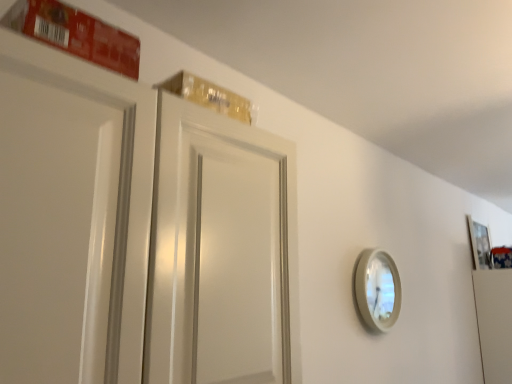
Question: In the image, is wooden picture frame at upper right positioned in front of or behind white glossy mirror at right?

Choices:
 (A) behind
 (B) front

Answer: (A)

Question: Is point (483, 259) closer or farther from the camera than point (361, 279)?

Choices:
 (A) farther
 (B) closer

Answer: (A)

Question: From a real-world perspective, relative to white glossy mirror at right, is wooden picture frame at upper right vertically above or below?

Choices:
 (A) above
 (B) below

Answer: (A)

Question: From a real-world perspective, relative to wooden picture frame at upper right, is white glossy mirror at right vertically above or below?

Choices:
 (A) below
 (B) above

Answer: (A)

Question: From the image's perspective, is white glossy mirror at right positioned above or below wooden picture frame at upper right?

Choices:
 (A) below
 (B) above

Answer: (A)

Question: In terms of size, does white glossy mirror at right appear bigger or smaller than wooden picture frame at upper right?

Choices:
 (A) small
 (B) big

Answer: (A)

Question: In the image, is white glossy mirror at right positioned in front of or behind wooden picture frame at upper right?

Choices:
 (A) behind
 (B) front

Answer: (B)